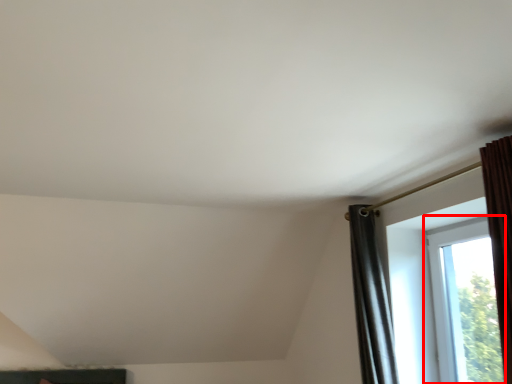
Question: Observing the image, what is the correct spatial positioning of window (annotated by the red box) in reference to window?

Choices:
 (A) left
 (B) right

Answer: (B)